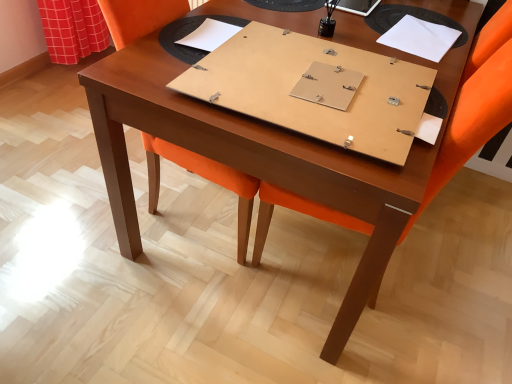
Find the location of a particular element. free spot to the right of orange fabric chair at center is located at coordinates (458, 272).